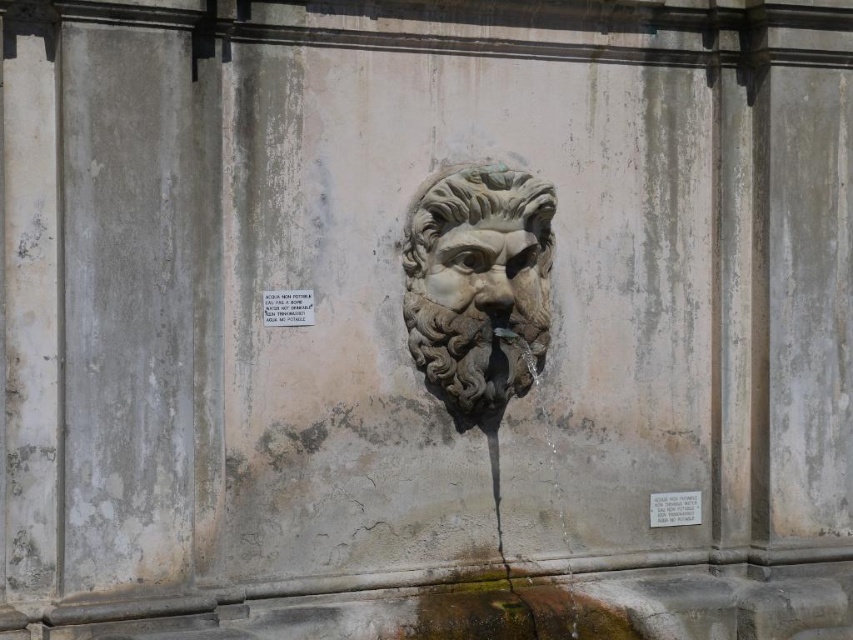
Question: Which object appears closest to the camera in this image?

Choices:
 (A) white marble lion at center
 (B) white stone plaque at upper center

Answer: (B)

Question: Is white stone plaque at upper center positioned in front of white stone plaque at center?

Choices:
 (A) yes
 (B) no

Answer: (A)

Question: Which point appears farthest from the camera in this image?

Choices:
 (A) (296, 301)
 (B) (460, 237)

Answer: (B)

Question: Which point is closer to the camera?

Choices:
 (A) white marble lion at center
 (B) white stone plaque at upper center
 (C) white stone plaque at center
 (D) carved stone face at center

Answer: (B)

Question: Is carved stone face at center thinner than white stone plaque at center?

Choices:
 (A) yes
 (B) no

Answer: (B)

Question: Is white marble lion at center further to camera compared to carved stone face at center?

Choices:
 (A) yes
 (B) no

Answer: (B)